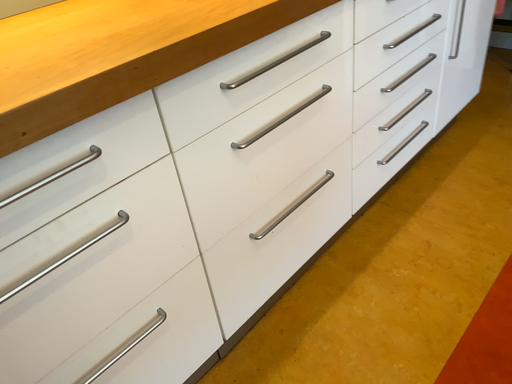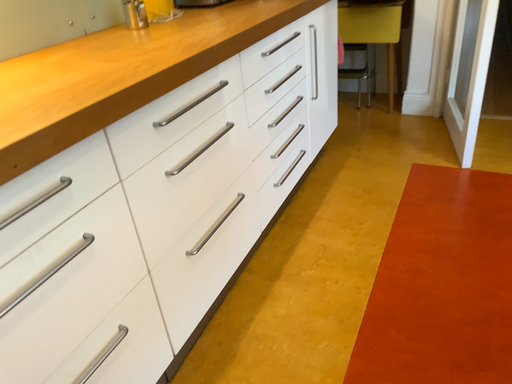
Question: Which way did the camera rotate in the video?

Choices:
 (A) rotated upward
 (B) rotated downward

Answer: (A)